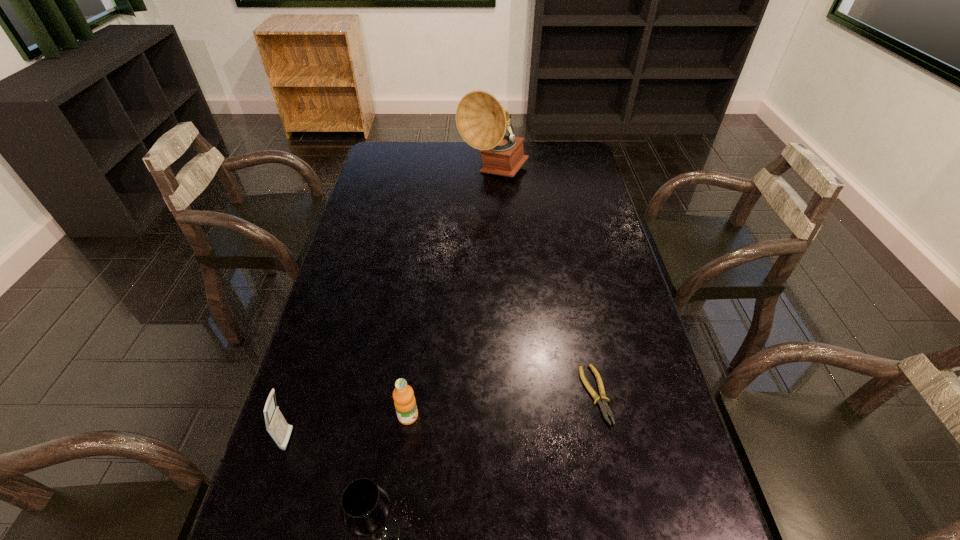
Locate an element on the screen. This screenshot has width=960, height=540. the shortest object is located at coordinates (604, 408).

The height and width of the screenshot is (540, 960). Identify the location of the rightmost object. (604, 408).

The height and width of the screenshot is (540, 960). I want to click on orange juice, so click(403, 395).

Where is `the second nearest object`? the second nearest object is located at coordinates (276, 425).

This screenshot has width=960, height=540. Find the location of `cellular telephone`. cellular telephone is located at coordinates (276, 425).

Identify the location of phonograph record. (481, 120).

The width and height of the screenshot is (960, 540). Find the location of `the tallest object`. the tallest object is located at coordinates (481, 120).

Find the location of a particular element. vacant space positioned on the back of the shortest object is located at coordinates (586, 347).

I want to click on free space located 0.270m on the label of the orange juice, so click(534, 441).

You are a GUI agent. You are given a task and a screenshot of the screen. Output one action in this format:
    pyautogui.click(x=<x>, y=<y>)
    Task: Click on the vacant area situated 0.220m on the label of the orange juice
    This screenshot has height=540, width=960.
    Given the screenshot: What is the action you would take?
    pyautogui.click(x=512, y=437)